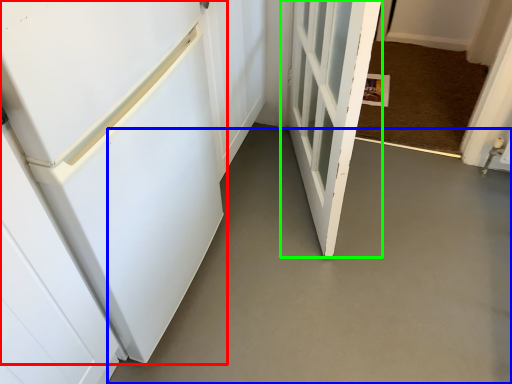
Question: Estimate the real-world distances between objects in this image. Which object is farther from door (highlighted by a red box), concrete (highlighted by a blue box) or door (highlighted by a green box)?

Choices:
 (A) concrete
 (B) door

Answer: (A)